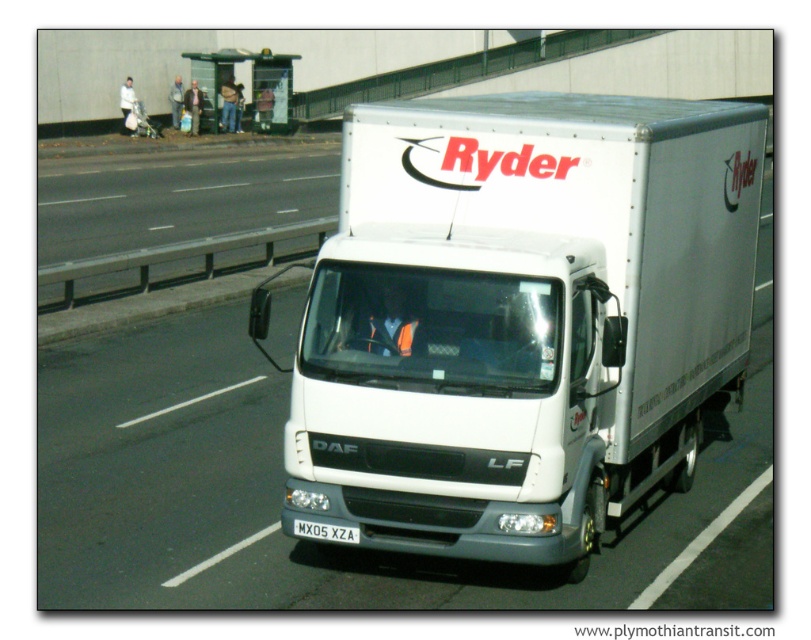
Can you confirm if white matte truck at center is shorter than white plastic license plate at center?

No, white matte truck at center is not shorter than white plastic license plate at center.

Does point (711, 176) come behind point (312, 532)?

Yes.

Does point (634, 168) lie behind point (337, 529)?

Yes, point (634, 168) is farther from viewer.

The width and height of the screenshot is (811, 640). I want to click on white matte truck at center, so click(x=521, y=317).